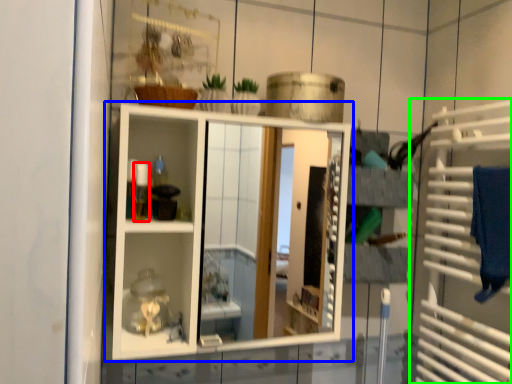
Question: Which object is the farthest from toiletry (highlighted by a red box)? Choose among these: shelf (highlighted by a blue box) or cage (highlighted by a green box).

Choices:
 (A) shelf
 (B) cage

Answer: (A)